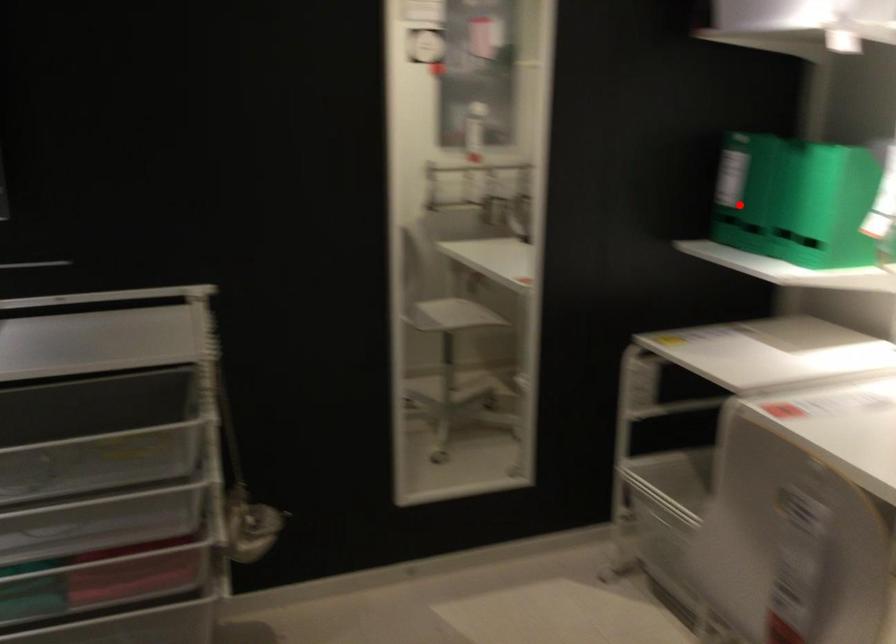
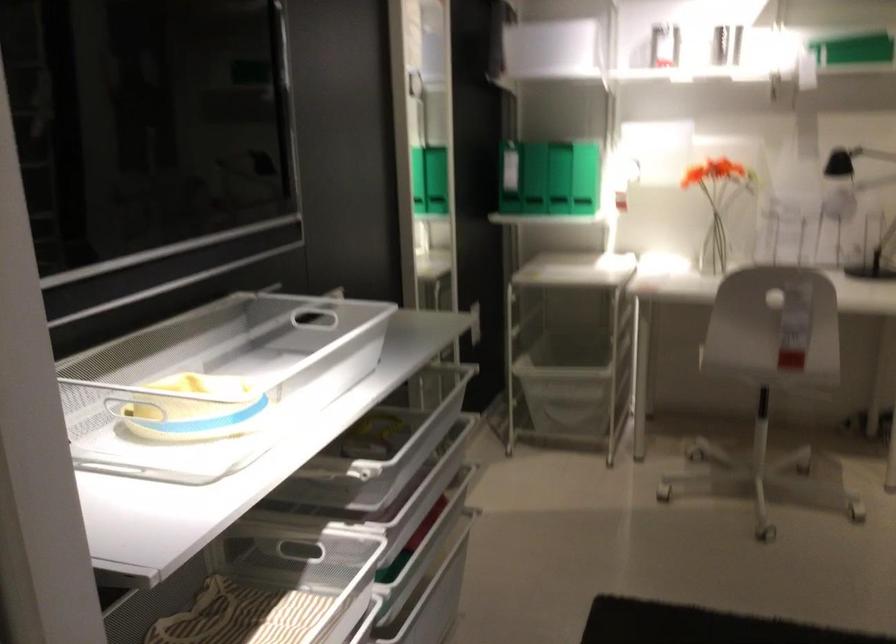
Question: A red point is marked in image1. In image2, is the corresponding 3D point closer to the camera or farther? Reply with the corresponding letter.

Choices:
 (A) The corresponding 3D point is closer.
 (B) The corresponding 3D point is farther.

Answer: (B)